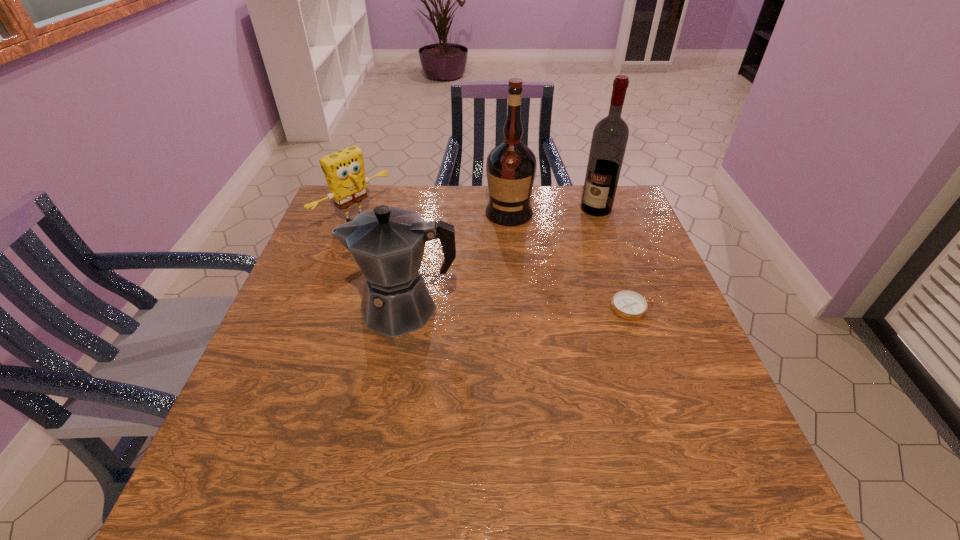
At what (x,y) coordinates should I click in order to perform the action: click on vacant spot on the desktop that is between the coffeepot and the compass and is positioned on the front and back of the alcohol. Please return your answer as a coordinate pair (x, y). Image resolution: width=960 pixels, height=540 pixels. Looking at the image, I should click on tap(527, 308).

This screenshot has height=540, width=960. I want to click on vacant space on the desktop that is between the third shortest object and the compass and is positioned on the surface of the third object from right to left, so click(x=486, y=308).

You are a GUI agent. You are given a task and a screenshot of the screen. Output one action in this format:
    pyautogui.click(x=<x>, y=<y>)
    Task: Click on the vacant space on the desktop that is between the coffeepot and the shortest object and is positioned on the face of the sponge
    The width and height of the screenshot is (960, 540).
    Given the screenshot: What is the action you would take?
    coord(488,308)